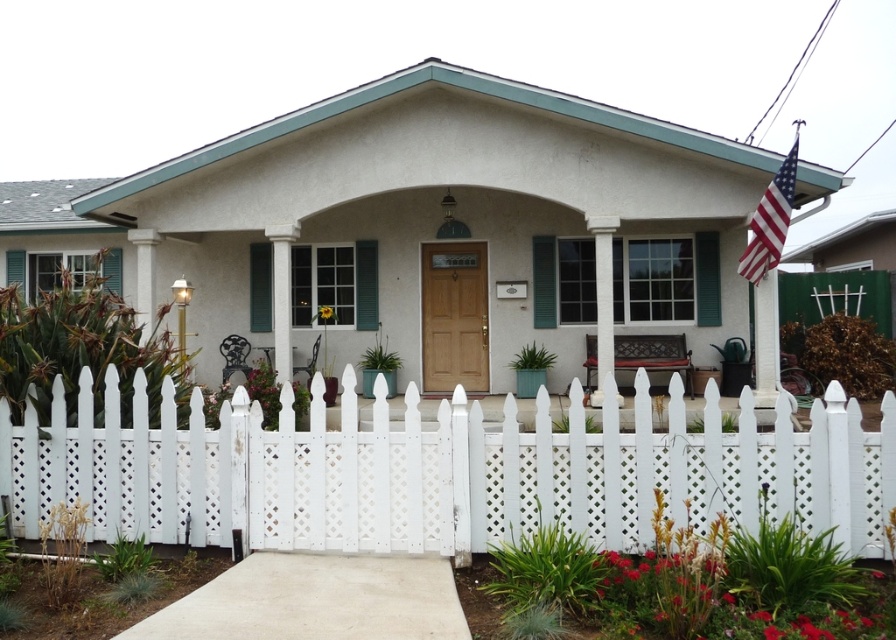
You are standing at the front door of the house and want to know what is located at the coordinates point [441,472]. What object is there?

The white picket fence at center is located at point [441,472].